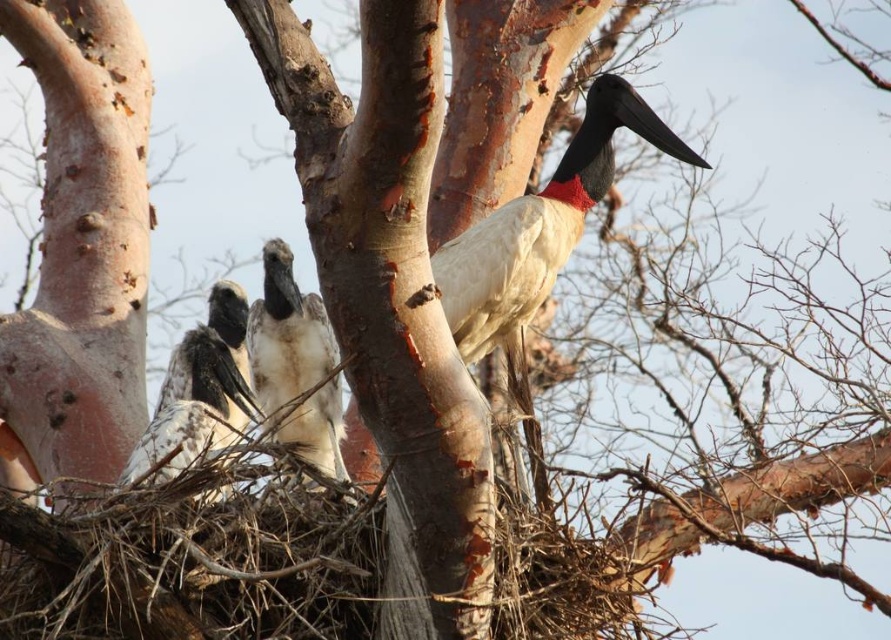
You are a birdwatcher standing at the base of the tree. You notice a white feathered bird at center and another bird with a red patch around its neck. How far apart are these two birds from each other?

The two birds are 7.57 meters apart.

You are observing a group of birds in a tree. There is a white feathered bird at center. Based on their positions, which bird is closer to the center of the tree?

The white feathered bird at center is located at point (295, 362), which is closest to the center of the tree.